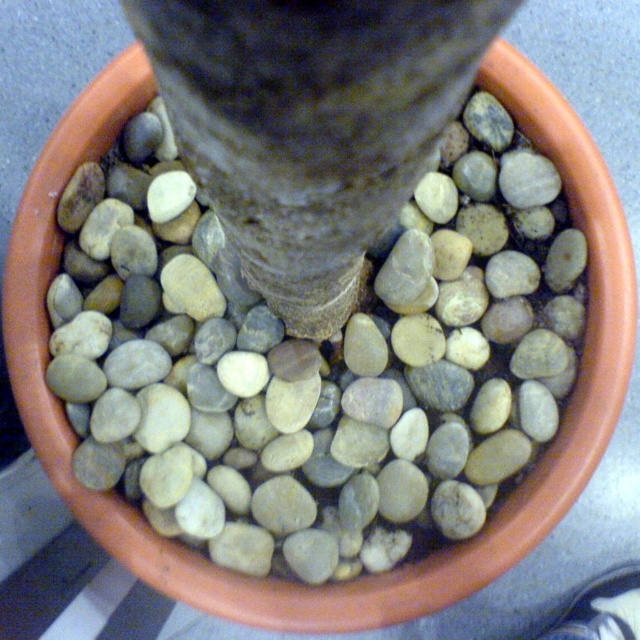
Can you confirm if smooth gray pebble at center is positioned below smooth gray bark at center?

Indeed, smooth gray pebble at center is positioned under smooth gray bark at center.

This screenshot has width=640, height=640. In order to click on smooth gray pebble at center in this screenshot , I will do `click(317, 360)`.